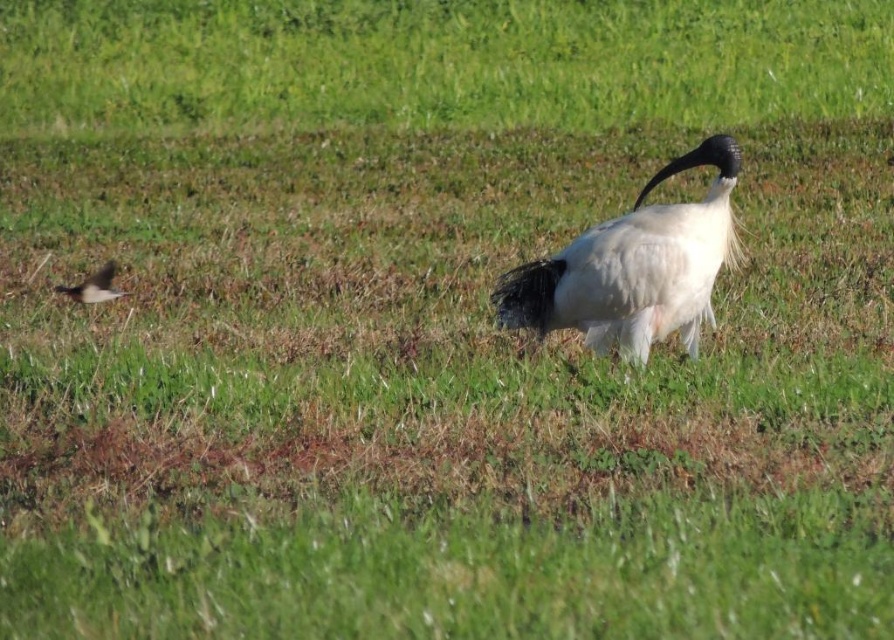
Question: Considering the relative positions of white glossy bird at center and brown feathered bird at left in the image provided, where is white glossy bird at center located with respect to brown feathered bird at left?

Choices:
 (A) right
 (B) left

Answer: (A)

Question: Considering the relative positions of white glossy bird at center and brown feathered bird at left in the image provided, where is white glossy bird at center located with respect to brown feathered bird at left?

Choices:
 (A) below
 (B) above

Answer: (A)

Question: Observing the image, what is the correct spatial positioning of white glossy bird at center in reference to brown feathered bird at left?

Choices:
 (A) right
 (B) left

Answer: (A)